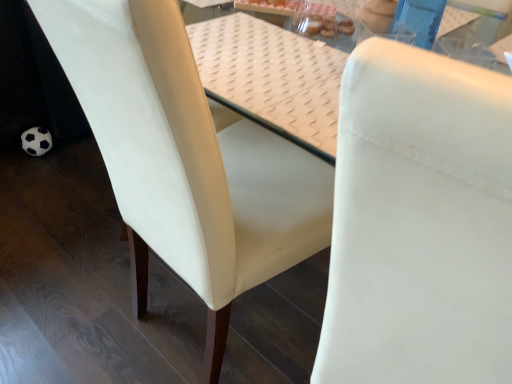
Measure the distance between white textured table at center and camera.

A distance of 61.42 centimeters exists between white textured table at center and camera.

Describe the element at coordinates (271, 78) in the screenshot. I see `white textured table at center` at that location.

You are a GUI agent. You are given a task and a screenshot of the screen. Output one action in this format:
    pyautogui.click(x=<x>, y=<y>)
    Task: Click on the white leather chair at center, which is the 1th chair in right-to-left order
    The image size is (512, 384).
    Given the screenshot: What is the action you would take?
    pyautogui.click(x=420, y=222)

The image size is (512, 384). I want to click on table that is behind the white leather chair at center, placed as the 2th chair when sorted from right to left, so click(271, 78).

From the image's perspective, which is above, white leather chair at center, placed as the 2th chair when sorted from right to left, or white textured table at center?

white textured table at center, from the image's perspective.

Is white leather chair at center, placed as the 2th chair when sorted from right to left, oriented away from white textured table at center?

Yes, white leather chair at center, placed as the 2th chair when sorted from right to left,'s orientation is away from white textured table at center.

From a real-world perspective, is white leather chair at center, placed as the 2th chair when sorted from right to left, over white textured table at center?

No, from a real-world perspective, white leather chair at center, placed as the 2th chair when sorted from right to left, is not over white textured table at center

Which object is positioned more to the left, white leather chair at center, the second chair positioned from the left, or white textured table at center?

white textured table at center is more to the left.

Is white leather chair at center, the second chair positioned from the left, next to white textured table at center and touching it?

No, white leather chair at center, the second chair positioned from the left, is not beside white textured table at center.

Which is correct: white leather chair at center, the second chair positioned from the left, is inside white textured table at center, or outside of it?

white leather chair at center, the second chair positioned from the left, exists outside the volume of white textured table at center.

Is white textured table at center in front of white leather chair at center, placed as the 2th chair when sorted from right to left?

No, white textured table at center is further to the viewer.

Who is bigger, white textured table at center or white leather chair at center, acting as the 1th chair starting from the left?

With larger size is white leather chair at center, acting as the 1th chair starting from the left.

Does white textured table at center have a lesser height compared to white leather chair at center, placed as the 2th chair when sorted from right to left?

Yes, white textured table at center is shorter than white leather chair at center, placed as the 2th chair when sorted from right to left.

Is white leather chair at center, acting as the 1th chair starting from the left, surrounded by white textured table at center?

No, white leather chair at center, acting as the 1th chair starting from the left, is located outside of white textured table at center.

Can you tell me how much white leather chair at center, the second chair positioned from the left, and white leather chair at center, placed as the 2th chair when sorted from right to left, differ in facing direction?

There is a 7.09-degree angle between the facing directions of white leather chair at center, the second chair positioned from the left, and white leather chair at center, placed as the 2th chair when sorted from right to left.

Which object is closer to the camera, white leather chair at center, which is the 1th chair in right-to-left order, or white leather chair at center, acting as the 1th chair starting from the left?

white leather chair at center, which is the 1th chair in right-to-left order, is in front.

From a real-world perspective, between white leather chair at center, which is the 1th chair in right-to-left order, and white leather chair at center, placed as the 2th chair when sorted from right to left, who is vertically higher?

white leather chair at center, which is the 1th chair in right-to-left order, is physically above.

Is white leather chair at center, which is the 1th chair in right-to-left order, inside or outside of white leather chair at center, acting as the 1th chair starting from the left?

white leather chair at center, which is the 1th chair in right-to-left order, is not inside white leather chair at center, acting as the 1th chair starting from the left, it's outside.

Is white leather chair at center, placed as the 2th chair when sorted from right to left, smaller than white leather chair at center, the second chair positioned from the left?

Incorrect, white leather chair at center, placed as the 2th chair when sorted from right to left, is not smaller in size than white leather chair at center, the second chair positioned from the left.

From the image's perspective, which is below, white leather chair at center, placed as the 2th chair when sorted from right to left, or white leather chair at center, which is the 1th chair in right-to-left order?

white leather chair at center, which is the 1th chair in right-to-left order, is shown below in the image.

From a real-world perspective, which is physically below, white leather chair at center, acting as the 1th chair starting from the left, or white leather chair at center, the second chair positioned from the left?

white leather chair at center, acting as the 1th chair starting from the left, is physically lower.

Consider the image. Is white leather chair at center, placed as the 2th chair when sorted from right to left, facing away from white leather chair at center, the second chair positioned from the left?

No, white leather chair at center, placed as the 2th chair when sorted from right to left, is not facing the opposite direction of white leather chair at center, the second chair positioned from the left.

Can you confirm if white textured table at center is positioned to the right of white leather chair at center, which is the 1th chair in right-to-left order?

No.

Considering the relative sizes of white textured table at center and white leather chair at center, the second chair positioned from the left, in the image provided, is white textured table at center taller than white leather chair at center, the second chair positioned from the left,?

Incorrect, the height of white textured table at center is not larger of that of white leather chair at center, the second chair positioned from the left.

From the image's perspective, which one is positioned lower, white textured table at center or white leather chair at center, which is the 1th chair in right-to-left order?

white leather chair at center, which is the 1th chair in right-to-left order, from the image's perspective.

Looking at this image, measure the distance between white textured table at center and white leather chair at center, which is the 1th chair in right-to-left order.

The distance of white textured table at center from white leather chair at center, which is the 1th chair in right-to-left order, is 37.04 centimeters.

Image resolution: width=512 pixels, height=384 pixels. What are the coordinates of `table that is behind the white leather chair at center, acting as the 1th chair starting from the left` in the screenshot? It's located at [x=271, y=78].

Image resolution: width=512 pixels, height=384 pixels. I want to click on table that is above the white leather chair at center, which is the 1th chair in right-to-left order (from the image's perspective), so click(271, 78).

Looking at the image, which one is located closer to white leather chair at center, placed as the 2th chair when sorted from right to left, white leather chair at center, the second chair positioned from the left, or white textured table at center?

Based on the image, white textured table at center appears to be nearer to white leather chair at center, placed as the 2th chair when sorted from right to left.

Looking at the image, which one is located further to white leather chair at center, which is the 1th chair in right-to-left order, white textured table at center or white leather chair at center, placed as the 2th chair when sorted from right to left?

white textured table at center lies further to white leather chair at center, which is the 1th chair in right-to-left order, than the other object.

Estimate the real-world distances between objects in this image. Which object is further from white textured table at center, white leather chair at center, acting as the 1th chair starting from the left, or white leather chair at center, which is the 1th chair in right-to-left order?

Based on the image, white leather chair at center, which is the 1th chair in right-to-left order, appears to be further to white textured table at center.

Looking at the image, which one is located closer to white textured table at center, white leather chair at center, the second chair positioned from the left, or white leather chair at center, acting as the 1th chair starting from the left?

white leather chair at center, acting as the 1th chair starting from the left.

In the scene shown: Which object lies nearer to the anchor point white leather chair at center, the second chair positioned from the left, white leather chair at center, acting as the 1th chair starting from the left, or white textured table at center?

Based on the image, white leather chair at center, acting as the 1th chair starting from the left, appears to be nearer to white leather chair at center, the second chair positioned from the left.

When comparing their distances from white leather chair at center, acting as the 1th chair starting from the left, does white textured table at center or white leather chair at center, the second chair positioned from the left, seem further?

The object further to white leather chair at center, acting as the 1th chair starting from the left, is white leather chair at center, the second chair positioned from the left.

Where is `chair between white textured table at center and white leather chair at center, which is the 1th chair in right-to-left order, vertically`? The height and width of the screenshot is (384, 512). chair between white textured table at center and white leather chair at center, which is the 1th chair in right-to-left order, vertically is located at coordinates (186, 159).